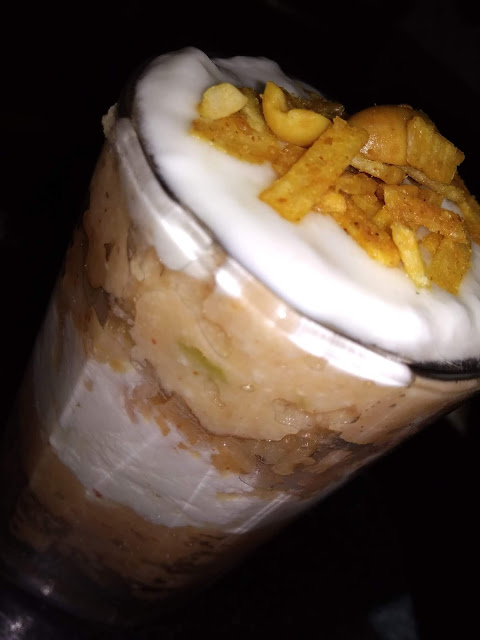
Find the location of a particular element. clear tall glass is located at coordinates (152, 212).